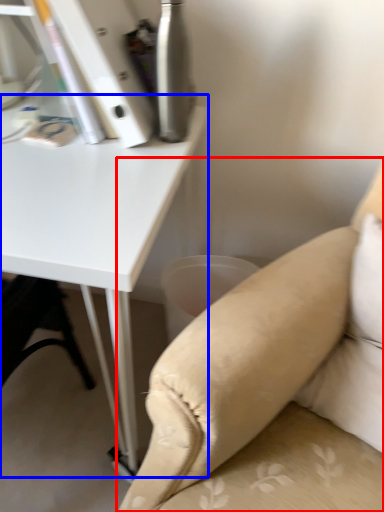
Question: Which of the following is the closest to the observer, studio couch (highlighted by a red box) or table (highlighted by a blue box)?

Choices:
 (A) studio couch
 (B) table

Answer: (A)